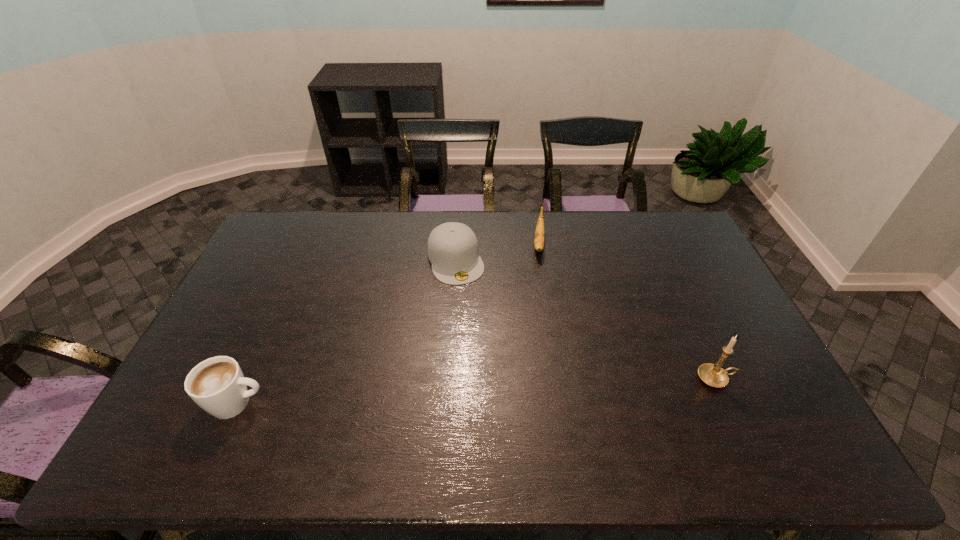
Where is `vacant point located between the cappuccino and the second object from left to right`? vacant point located between the cappuccino and the second object from left to right is located at coordinates pos(347,332).

This screenshot has width=960, height=540. Find the location of `vacant space in between the third object from right to left and the cappuccino`. vacant space in between the third object from right to left and the cappuccino is located at coordinates (347, 332).

Image resolution: width=960 pixels, height=540 pixels. What are the coordinates of `unoccupied position between the cap and the candle holder` in the screenshot? It's located at (586, 319).

Where is `vacant space that's between the cap and the banana`? vacant space that's between the cap and the banana is located at coordinates 497,252.

Where is `vacant region between the banana and the cappuccino`? vacant region between the banana and the cappuccino is located at coordinates (388, 323).

Locate an element on the screen. object that ranks as the third closest to the cappuccino is located at coordinates (713, 375).

Where is `object that can be found as the second closest to the cap`? object that can be found as the second closest to the cap is located at coordinates (217, 385).

The width and height of the screenshot is (960, 540). Identify the location of free location that satisfies the following two spatial constraints: 1. on the front side of the candle holder; 2. on the handle side of the third object from right to left. (448, 379).

Where is `free space that satisfies the following two spatial constraints: 1. on the back side of the banana; 2. on the left side of the third object from right to left`? free space that satisfies the following two spatial constraints: 1. on the back side of the banana; 2. on the left side of the third object from right to left is located at coordinates (457, 244).

Locate an element on the screen. free space in the image that satisfies the following two spatial constraints: 1. on the front side of the candle holder; 2. on the handle side of the third object from right to left is located at coordinates (448, 379).